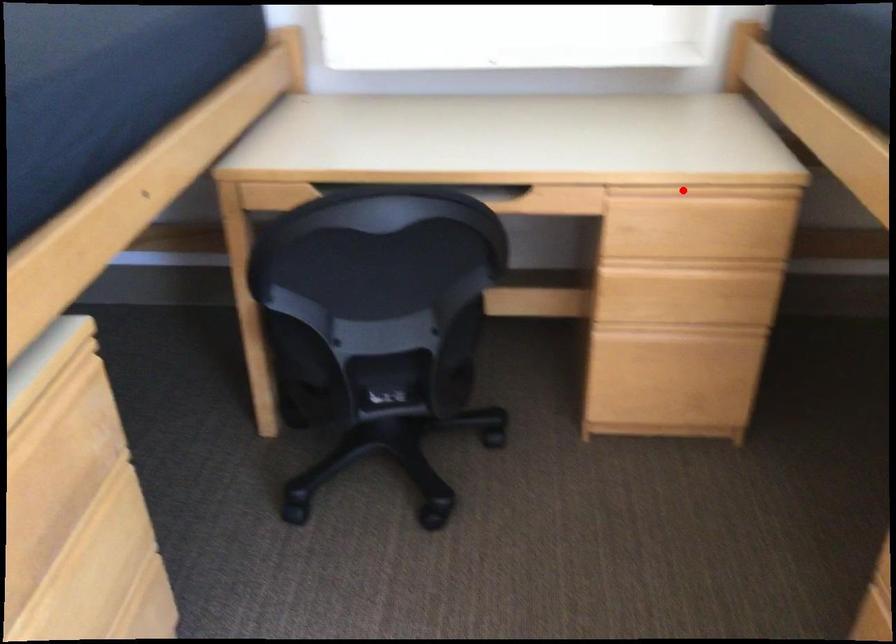
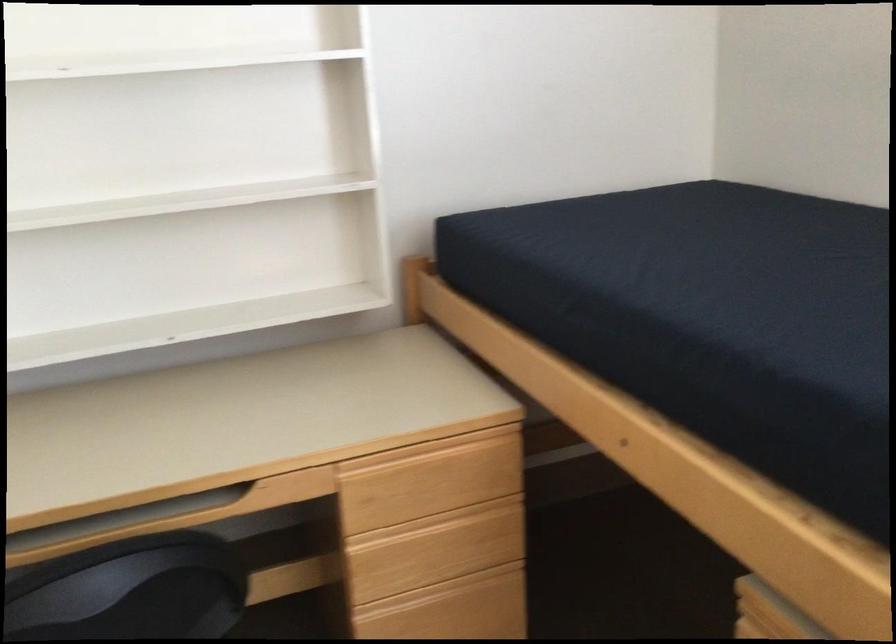
The point at the highlighted location is marked in the first image. Where is the corresponding point in the second image?

(417, 451)